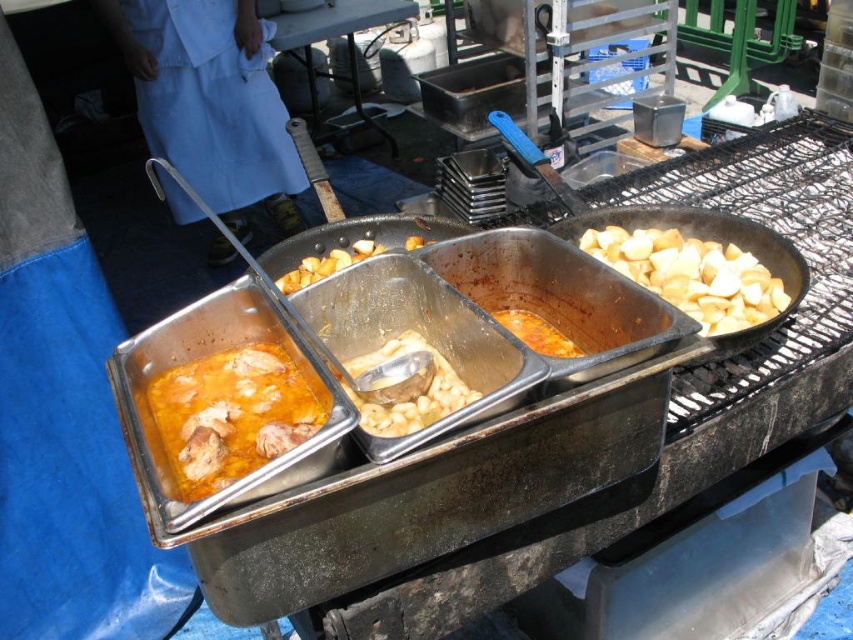
You are a food vendor at an outdoor event and need to determine which of the two dishes, the golden brown potato at center or the orange matte stew at center, can fit into a 15 cm wide serving tray. Based on their sizes, which dish would you choose?

The golden brown potato at center has a larger width than the orange matte stew at center. Since the potato is wider, it might not fit into the 15 cm tray. Therefore, the orange matte stew at center would be the better choice as it is narrower and more likely to fit within the tray.

You are a food vendor at an outdoor event and need to locate the golden brown potato at center. According to the coordinates provided, where exactly is it positioned?

The golden brown potato at center is located at point (326,264).

You are a food vendor at an outdoor event and need to place a 16 inch wide serving tray between the yellowish matte chicken stew at lower left and the orange matte stew at center. Will the tray fit without overlapping either container?

The yellowish matte chicken stew at lower left and orange matte stew at center are 16.10 inches apart. Since the tray is 16 inches wide, there is a slight gap of 0.10 inches, so the tray can fit without overlapping either container.